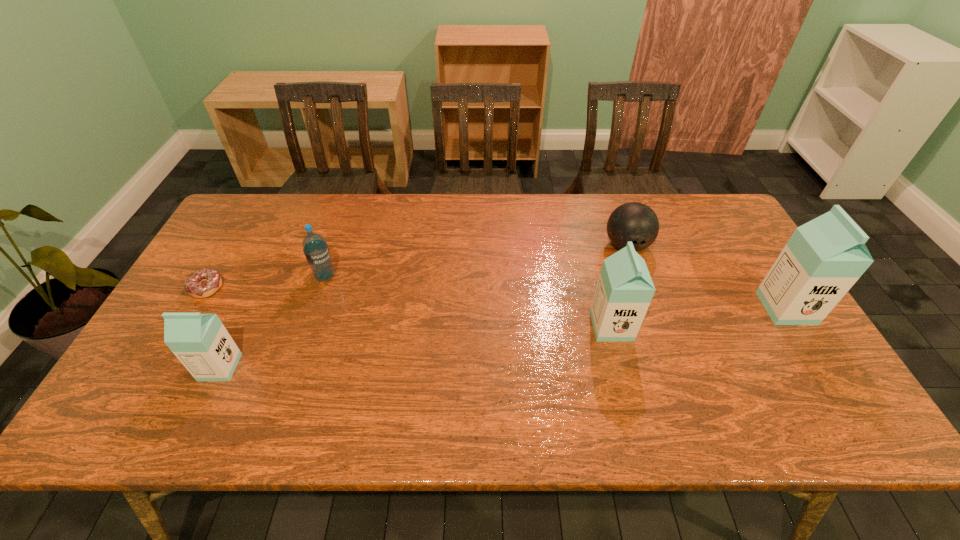
Locate which milk carton is the closest to the rightmost milk carton. Please provide its 2D coordinates. Your answer should be formatted as a tuple, i.e. [(x, y)], where the tuple contains the x and y coordinates of a point satisfying the conditions above.

[(624, 291)]

Locate an element on the screen. milk carton that can be found as the third closest to the bowling ball is located at coordinates (200, 341).

At what (x,y) coordinates should I click in order to perform the action: click on vacant space that satisfies the following two spatial constraints: 1. on the back side of the nearest milk carton; 2. on the left side of the second shortest milk carton. Please return your answer as a coordinate pair (x, y). This screenshot has height=540, width=960. Looking at the image, I should click on [x=239, y=326].

Where is `free spot that satisfies the following two spatial constraints: 1. on the grip area of the second shortest object; 2. on the left side of the rightmost milk carton`? This screenshot has height=540, width=960. free spot that satisfies the following two spatial constraints: 1. on the grip area of the second shortest object; 2. on the left side of the rightmost milk carton is located at coordinates point(648,308).

At what (x,y) coordinates should I click in order to perform the action: click on free location that satisfies the following two spatial constraints: 1. on the back side of the rightmost milk carton; 2. on the right side of the second tallest object. Please return your answer as a coordinate pair (x, y). The height and width of the screenshot is (540, 960). Looking at the image, I should click on (607, 308).